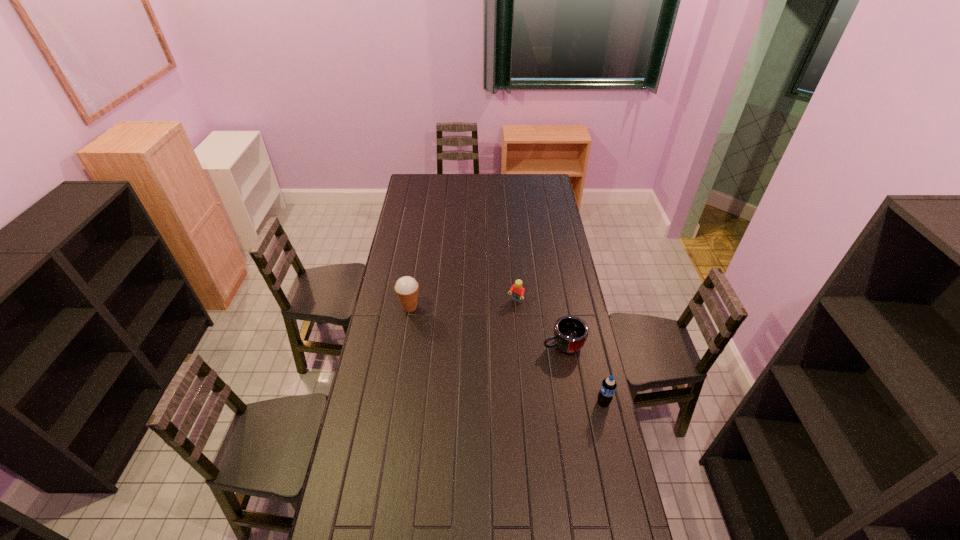
Locate an element on the screen. The image size is (960, 540). free region located 0.270m on the side of the mug with the handle is located at coordinates pyautogui.click(x=483, y=367).

Image resolution: width=960 pixels, height=540 pixels. I want to click on vacant area located 0.220m on the side of the mug with the handle, so click(x=494, y=363).

In order to click on object located in the left edge section of the desktop in this screenshot , I will do `click(406, 287)`.

Where is `soda bottle that is at the right edge`? The height and width of the screenshot is (540, 960). soda bottle that is at the right edge is located at coordinates (608, 386).

Where is `mug that is at the right edge`? This screenshot has width=960, height=540. mug that is at the right edge is located at coordinates (570, 332).

Find the location of a particular element. The height and width of the screenshot is (540, 960). vacant region at the far edge is located at coordinates (455, 186).

In the image, there is a desktop. Where is `vacant space at the left edge`? vacant space at the left edge is located at coordinates (408, 223).

Find the location of a particular element. vacant space at the right edge of the desktop is located at coordinates (562, 301).

What are the coordinates of `vacant point at the near right corner` in the screenshot? It's located at (598, 536).

The image size is (960, 540). I want to click on empty space between the Lego and the soda bottle, so (560, 352).